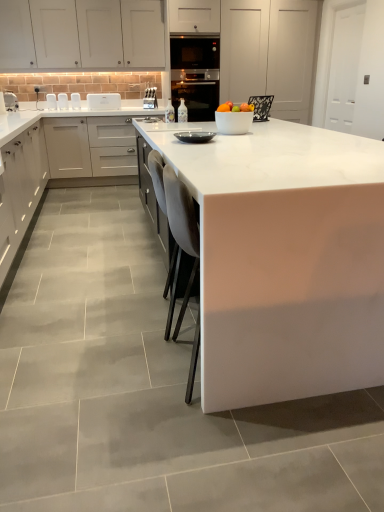
Question: Is white glossy countertop at center, the 2th countertop positioned from the right, bigger or smaller than black glass oven at center?

Choices:
 (A) big
 (B) small

Answer: (A)

Question: Considering the positions of point (82, 129) and point (205, 108), is point (82, 129) closer or farther from the camera than point (205, 108)?

Choices:
 (A) closer
 (B) farther

Answer: (A)

Question: Considering the real-world distances, which object is closest to the matte black bowl at center, acting as the 3th appliance starting from the left?

Choices:
 (A) white marble countertop at center, which appears as the 2th countertop when viewed from the left
 (B) metallic knife block at center, which is the 1th appliance from back to front
 (C) white glossy microwave at upper center
 (D) white glossy bowl at center, the 1th appliance in the right-to-left sequence
 (E) black glass oven at center

Answer: (D)

Question: Estimate the real-world distances between objects in this image. Which object is closer to the white glossy microwave at upper left, the third appliance positioned from the bottom?

Choices:
 (A) white glossy microwave at upper center
 (B) white matte cabinet at upper center, the 3th cabinetry from the bottom
 (C) matte white cabinets at left, acting as the second cabinetry starting from the bottom
 (D) white marble countertop at center, which is the 1th countertop in right-to-left order
 (E) matte black bowl at center, which ranks as the fourth appliance in top-to-bottom order

Answer: (C)